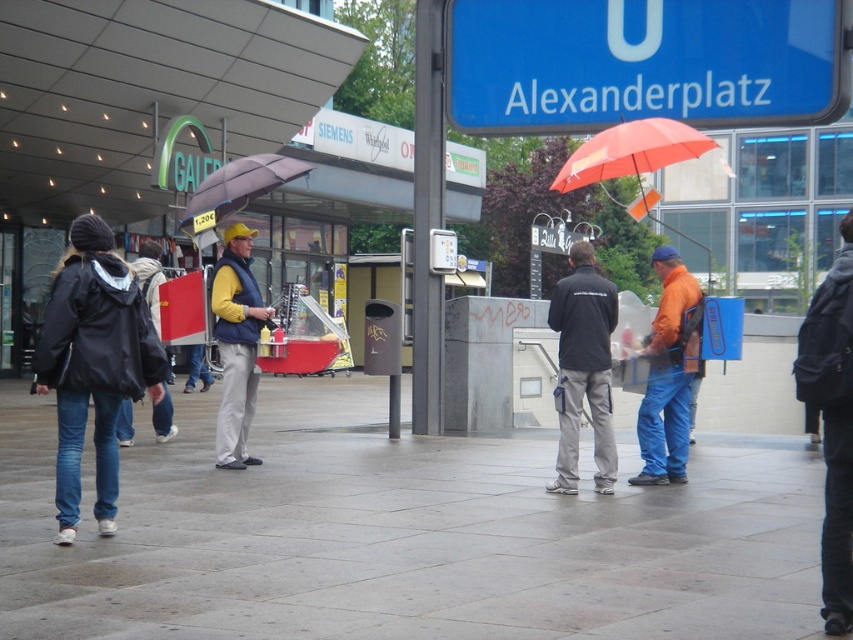
Who is shorter, blue plastic sign at upper center or yellow sweater at center?

blue plastic sign at upper center is shorter.

Is point (792, 38) positioned after point (225, 296)?

Yes, it is.

The height and width of the screenshot is (640, 853). Find the location of `blue plastic sign at upper center`. blue plastic sign at upper center is located at coordinates (643, 64).

How much distance is there between black fabric jacket at center and orange fabric umbrella at upper center?

2.25 meters

Is point (589, 321) positioned behind point (613, 145)?

No, (589, 321) is in front of (613, 145).

Locate an element on the screen. The width and height of the screenshot is (853, 640). black fabric jacket at center is located at coordinates (583, 369).

Is black backpack at lower right bigger than orange fabric backpack at center?

Indeed, black backpack at lower right has a larger size compared to orange fabric backpack at center.

Which is behind, point (840, 285) or point (651, 344)?

Point (651, 344)

Does point (828, 589) lie in front of point (686, 280)?

Yes, point (828, 589) is in front of point (686, 280).

Identify the location of black backpack at lower right. (833, 422).